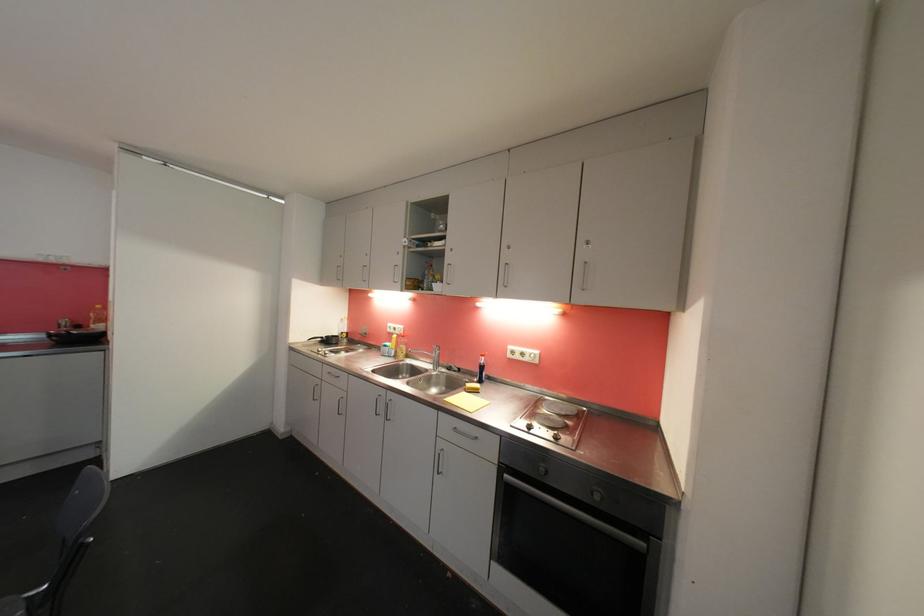
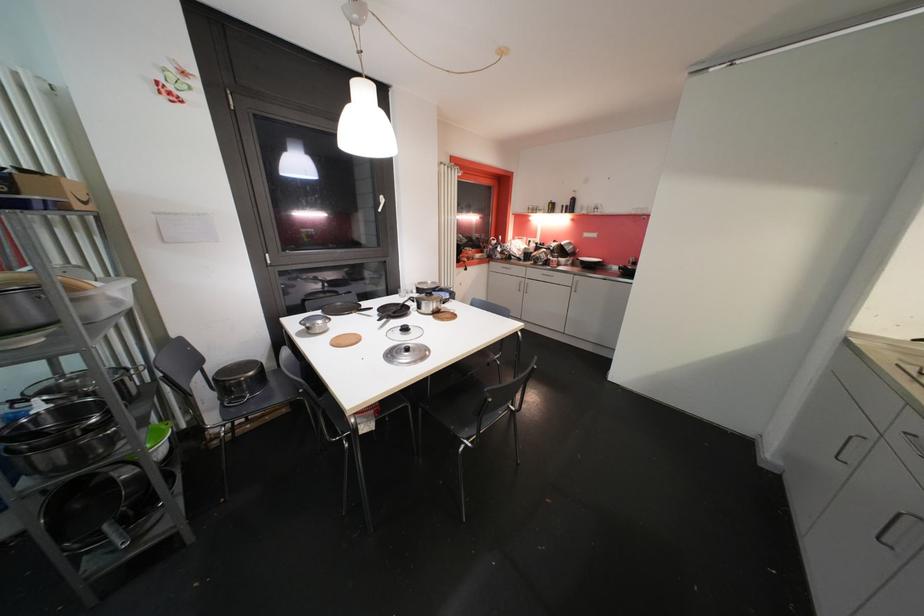
Based on the continuous images, in which direction is the camera rotating?

The camera's rotation is toward left-down.